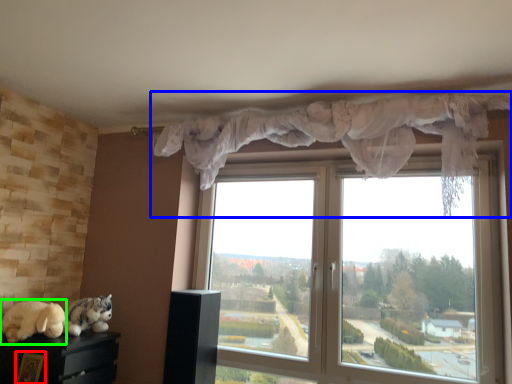
Question: Based on their relative distances, which object is farther from picture frame (highlighted by a red box)? Choose from curtain (highlighted by a blue box) and animal (highlighted by a green box).

Choices:
 (A) curtain
 (B) animal

Answer: (A)